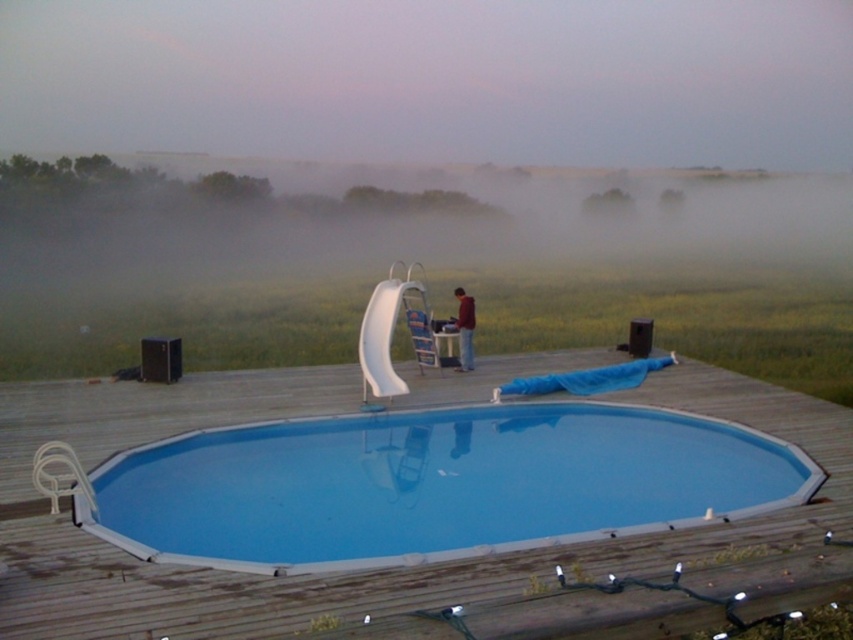
Between blue metallic pool at center and maroon sweater at center, which one is positioned lower?

Positioned lower is blue metallic pool at center.

Does blue metallic pool at center appear under maroon sweater at center?

Yes.

Is point (392, 513) positioned after point (463, 291)?

No, (392, 513) is in front of (463, 291).

Locate an element on the screen. The height and width of the screenshot is (640, 853). blue metallic pool at center is located at coordinates (433, 484).

From the picture: Between blue metallic pool at center and white plastic chair at center, which one appears on the right side from the viewer's perspective?

blue metallic pool at center is more to the right.

Is point (288, 484) more distant than point (416, 314)?

No, (288, 484) is in front of (416, 314).

Find the location of a particular element. The height and width of the screenshot is (640, 853). blue metallic pool at center is located at coordinates (433, 484).

Between white plastic chair at center and maroon sweater at center, which one appears on the right side from the viewer's perspective?

maroon sweater at center is more to the right.

You are a GUI agent. You are given a task and a screenshot of the screen. Output one action in this format:
    pyautogui.click(x=<x>, y=<y>)
    Task: Click on the white plastic chair at center
    The image size is (853, 640).
    Given the screenshot: What is the action you would take?
    pyautogui.click(x=424, y=340)